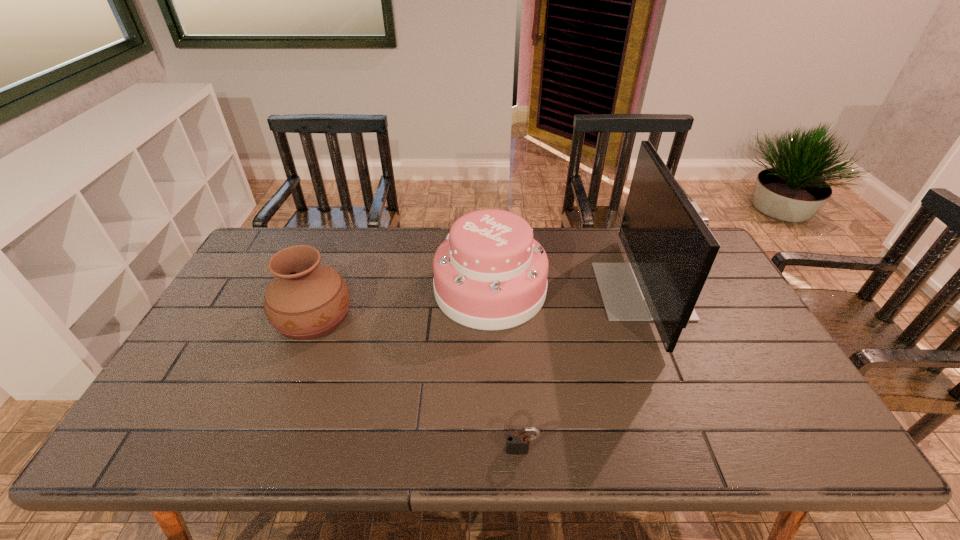
Select which object is the closest to the computer monitor. Please provide its 2D coordinates. Your answer should be formatted as a tuple, i.e. [(x, y)], where the tuple contains the x and y coordinates of a point satisfying the conditions above.

[(489, 273)]

Point out which object is positioned as the third nearest to the computer monitor. Please provide its 2D coordinates. Your answer should be formatted as a tuple, i.e. [(x, y)], where the tuple contains the x and y coordinates of a point satisfying the conditions above.

[(306, 300)]

The image size is (960, 540). I want to click on vacant area in the image that satisfies the following two spatial constraints: 1. on the screen of the computer monitor; 2. with the keyhole on the front of the padlock, so click(706, 450).